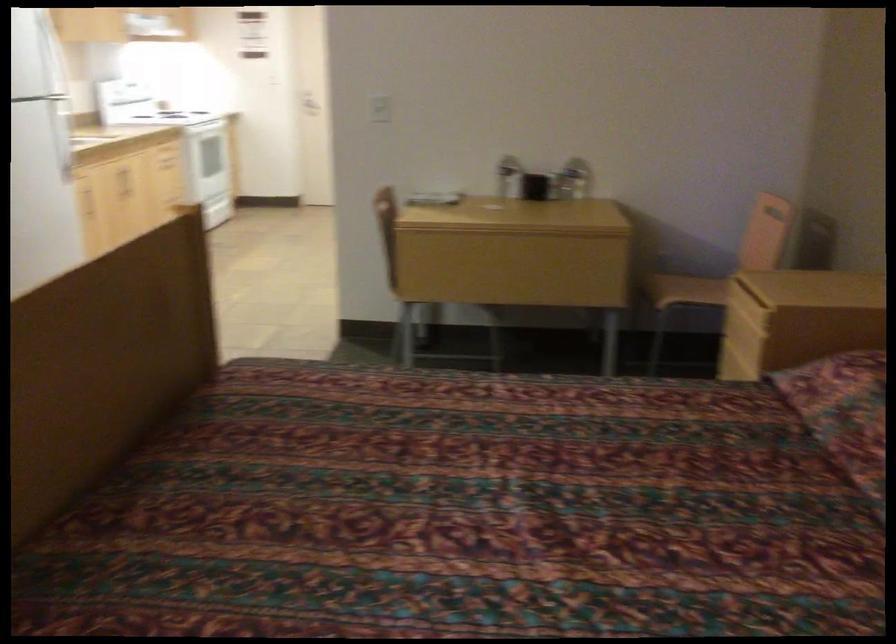
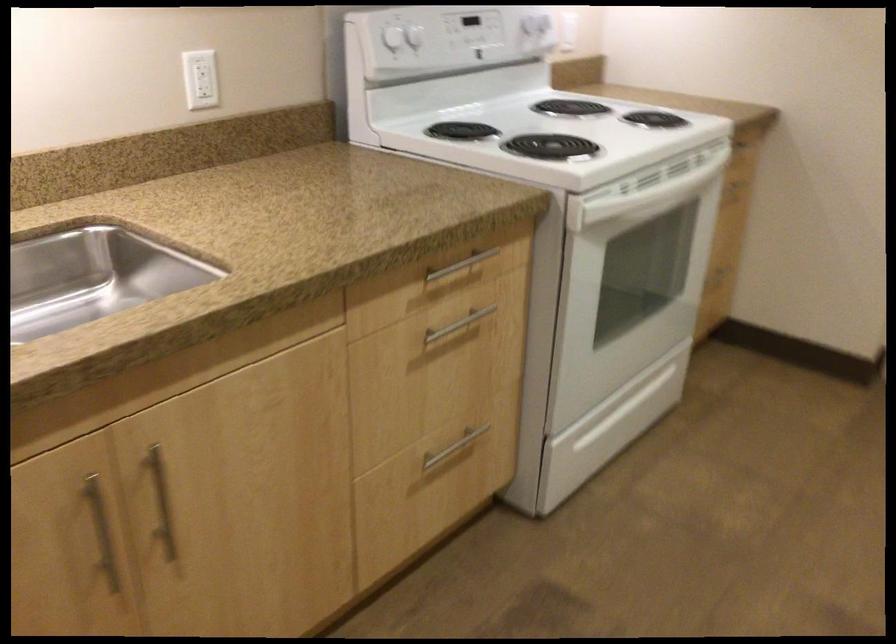
Find the pixel in the second image that matches (x=124, y=82) in the first image.

(392, 38)